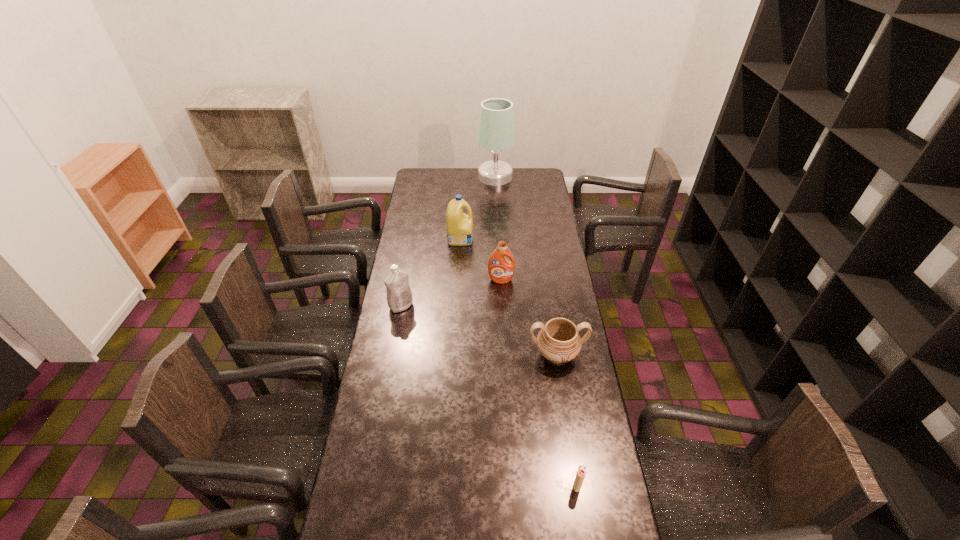
Identify the location of the nearest object. (581, 472).

Find the location of a particular element. The width and height of the screenshot is (960, 540). igniter is located at coordinates (581, 472).

At what (x,y) coordinates should I click in order to perform the action: click on vacant point located 0.360m on the base of the farthest object. Please return your answer as a coordinate pair (x, y). The image size is (960, 540). Looking at the image, I should click on (416, 177).

Locate an element on the screen. Image resolution: width=960 pixels, height=540 pixels. free location located on the base of the farthest object is located at coordinates (466, 177).

Locate an element on the screen. vacant region located on the base of the farthest object is located at coordinates (438, 177).

At what (x,y) coordinates should I click in order to perform the action: click on free space located 0.100m on the label of the second detergent from right to left. Please return your answer as a coordinate pair (x, y). This screenshot has width=960, height=540. Looking at the image, I should click on (493, 238).

Identify the location of vacant space located on the front-facing side of the fourth nearest object. Image resolution: width=960 pixels, height=540 pixels. (504, 339).

You are a GUI agent. You are given a task and a screenshot of the screen. Output one action in this format:
    pyautogui.click(x=<x>, y=<y>)
    Task: Click on the free space located 0.200m on the front of the nearest detergent
    The height and width of the screenshot is (540, 960).
    Given the screenshot: What is the action you would take?
    coord(393,354)

Where is `free space located on the front-facing side of the second nearest object`? This screenshot has width=960, height=540. free space located on the front-facing side of the second nearest object is located at coordinates (563, 393).

Where is `free location located on the back of the shortest object`? free location located on the back of the shortest object is located at coordinates (572, 456).